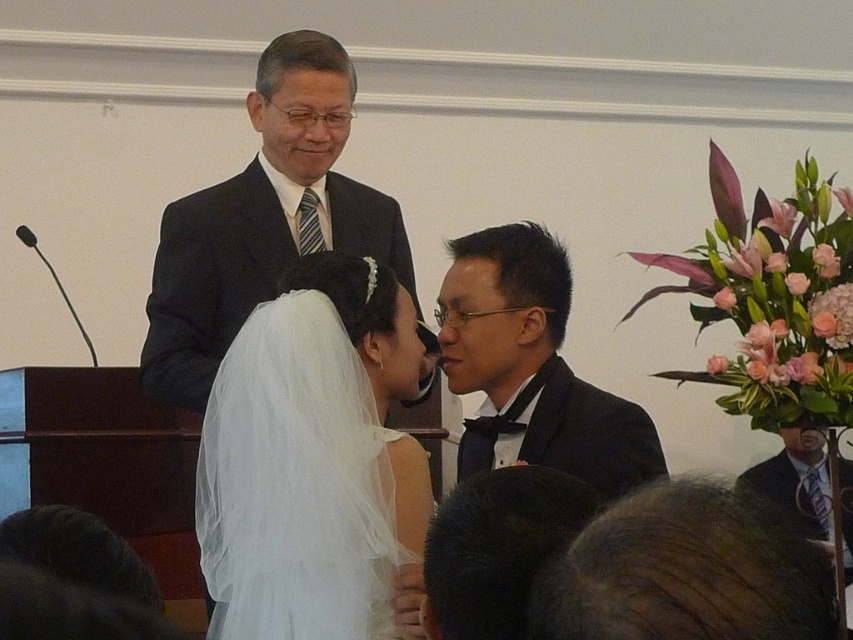
Can you confirm if white tulle veil at center is bigger than black satin suit at center?

Actually, white tulle veil at center might be smaller than black satin suit at center.

Can you confirm if white tulle veil at center is smaller than black satin suit at center?

Correct, white tulle veil at center occupies less space than black satin suit at center.

Is point (318, 323) positioned behind point (563, 428)?

No, it is in front of (563, 428).

In order to click on white tulle veil at center in this screenshot , I will do `click(311, 456)`.

Is point (410, 474) farther from camera compared to point (303, 76)?

That is False.

Does white tulle veil at center appear on the right side of dark blue suit at upper center?

Correct, you'll find white tulle veil at center to the right of dark blue suit at upper center.

Who is more forward, (276, 484) or (184, 220)?

Point (276, 484) is more forward.

In order to click on white tulle veil at center in this screenshot , I will do `click(311, 456)`.

Can you confirm if dark blue suit at upper center is smaller than black satin suit at center?

No.

Measure the distance from dark blue suit at upper center to black satin suit at center.

23.24 inches

Measure the distance between dark blue suit at upper center and camera.

dark blue suit at upper center and camera are 2.32 meters apart.

Where is `dark blue suit at upper center`? This screenshot has height=640, width=853. dark blue suit at upper center is located at coordinates (263, 220).